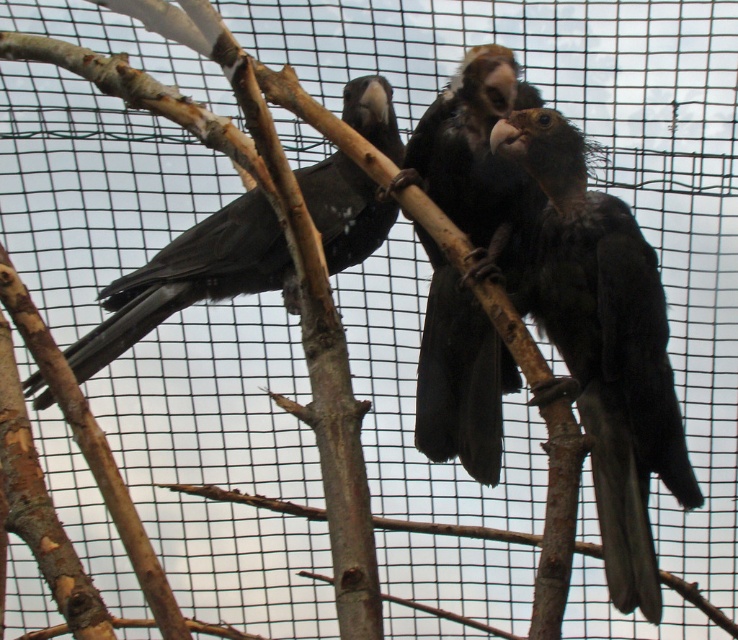
You are a zookeeper observing the birds in the aviary. You notice the shiny black parrot at center and the matte black bird at center. Which bird has a greater height?

The shiny black parrot at center is taller than the matte black bird at center, so the shiny black parrot at center has a greater height.

You are observing three birds on branches in an aviary. You notice a point labeled as point (x=472, y=257). Based on the scene, where is this point located?

The point (x=472, y=257) is on black feathers at center.